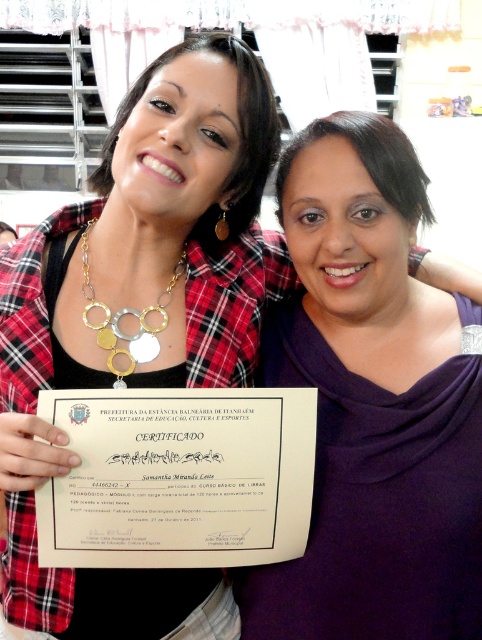
You are a photographer trying to adjust the lighting for a portrait. You notice the purple matte sweater at center and the gold metallic necklace at left. Which object should you focus the light on to ensure it stands out more, considering their sizes?

The purple matte sweater at center is much taller than the gold metallic necklace at left, so focusing the light on the purple matte sweater at center would make it stand out more due to its larger size.

You are standing 40 inches away from the image. If you want to touch the point at coordinate point [425,360], will you be able to reach it without moving closer?

The distance of point [425,360] from viewer is 35.49 inches. Since you are standing 40 inches away, you are farther than the required distance. You can reach it by moving 4.51 inches closer.

You are a photographer trying to adjust the lighting for a photo shoot. You notice a point at coordinates (372, 404) in the image. What object is located at this point?

The point at coordinates (372, 404) indicates the purple matte sweater at center.